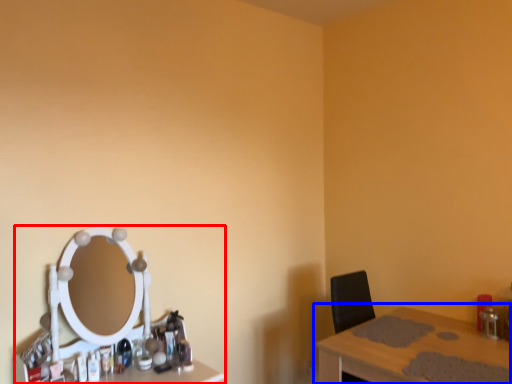
Question: Which object is closer to the camera taking this photo, computer desk (highlighted by a red box) or table (highlighted by a blue box)?

Choices:
 (A) computer desk
 (B) table

Answer: (B)